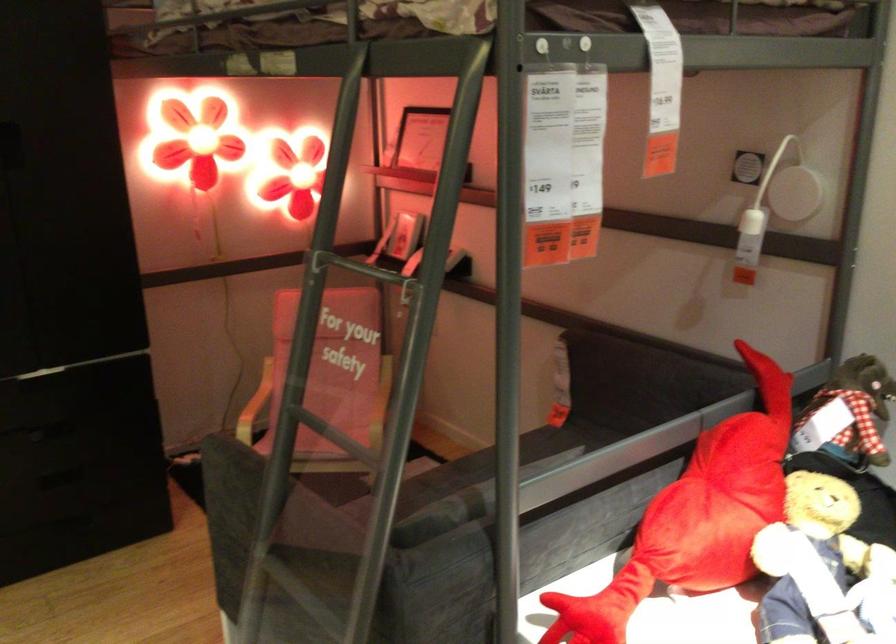
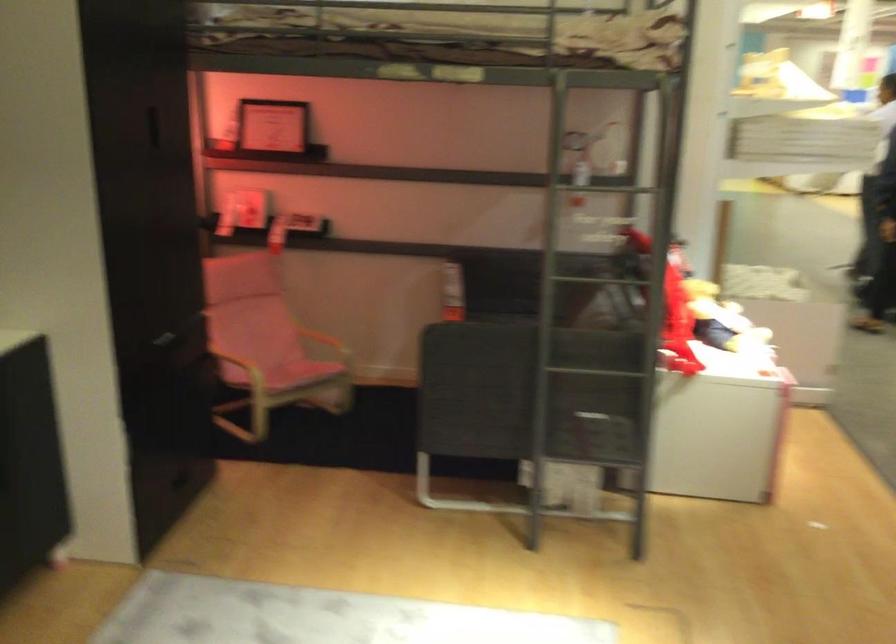
In the second image, find the point that corresponds to (x=316, y=418) in the first image.

(591, 278)